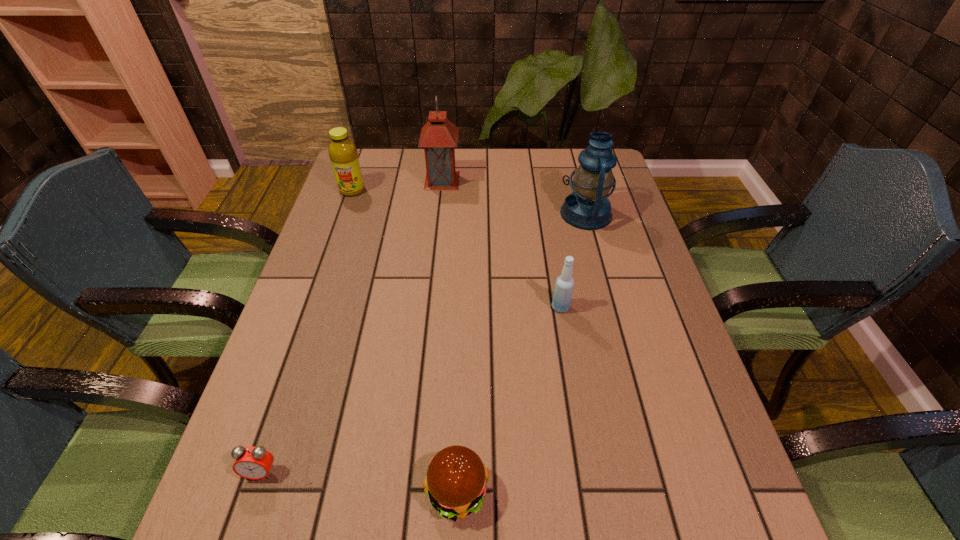
Where is `the left lantern`? the left lantern is located at coordinates (439, 136).

Find the location of a particular element. The height and width of the screenshot is (540, 960). the rightmost object is located at coordinates (588, 207).

Find the location of a particular element. The height and width of the screenshot is (540, 960). the right lantern is located at coordinates (588, 207).

The width and height of the screenshot is (960, 540). In order to click on fruit juice in this screenshot , I will do `click(343, 154)`.

This screenshot has height=540, width=960. I want to click on the third shortest object, so click(562, 296).

I want to click on bottle, so click(562, 296).

You are a GUI agent. You are given a task and a screenshot of the screen. Output one action in this format:
    pyautogui.click(x=<x>, y=<y>)
    Task: Click on the hamburger
    This screenshot has height=540, width=960.
    Given the screenshot: What is the action you would take?
    pyautogui.click(x=456, y=479)

I want to click on alarm clock, so click(254, 463).

Locate an element on the screen. This screenshot has height=540, width=960. vacant area situated on the back of the farther lantern is located at coordinates (444, 163).

You are a GUI agent. You are given a task and a screenshot of the screen. Output one action in this format:
    pyautogui.click(x=<x>, y=<y>)
    Task: Click on the free space located on the face of the right lantern
    
    Given the screenshot: What is the action you would take?
    pyautogui.click(x=438, y=214)